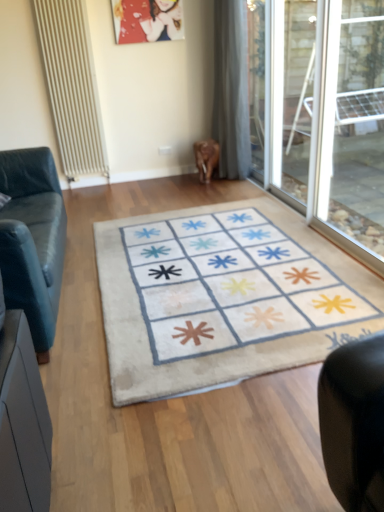
Question: Considering the relative sizes of matte plastic picture frame at upper center and beige textured radiator at left in the image provided, is matte plastic picture frame at upper center wider than beige textured radiator at left?

Choices:
 (A) yes
 (B) no

Answer: (B)

Question: From the image's perspective, does matte plastic picture frame at upper center appear lower than beige textured radiator at left?

Choices:
 (A) yes
 (B) no

Answer: (B)

Question: Does matte plastic picture frame at upper center have a larger size compared to beige textured radiator at left?

Choices:
 (A) no
 (B) yes

Answer: (A)

Question: Could you tell me if matte plastic picture frame at upper center is facing beige textured radiator at left?

Choices:
 (A) yes
 (B) no

Answer: (B)

Question: Is matte plastic picture frame at upper center behind beige textured radiator at left?

Choices:
 (A) yes
 (B) no

Answer: (A)

Question: From a real-world perspective, is gray fabric curtain at center physically located above or below leather couch at left?

Choices:
 (A) below
 (B) above

Answer: (B)

Question: Relative to leather couch at left, is gray fabric curtain at center in front or behind?

Choices:
 (A) front
 (B) behind

Answer: (B)

Question: Do you think gray fabric curtain at center is within leather couch at left, or outside of it?

Choices:
 (A) inside
 (B) outside

Answer: (B)

Question: Is gray fabric curtain at center taller or shorter than leather couch at left?

Choices:
 (A) short
 (B) tall

Answer: (B)

Question: Considering the positions of beige textured radiator at left and transparent glass window at right in the image, is beige textured radiator at left wider or thinner than transparent glass window at right?

Choices:
 (A) wide
 (B) thin

Answer: (B)

Question: Considering their positions, is beige textured radiator at left located in front of or behind transparent glass window at right?

Choices:
 (A) front
 (B) behind

Answer: (B)

Question: From a real-world perspective, is beige textured radiator at left positioned above or below transparent glass window at right?

Choices:
 (A) below
 (B) above

Answer: (B)

Question: Is beige textured radiator at left taller or shorter than transparent glass window at right?

Choices:
 (A) short
 (B) tall

Answer: (B)

Question: Considering the relative positions of beige fabric doormat at center and matte plastic picture frame at upper center in the image provided, is beige fabric doormat at center to the left or to the right of matte plastic picture frame at upper center?

Choices:
 (A) right
 (B) left

Answer: (A)

Question: Is beige fabric doormat at center taller or shorter than matte plastic picture frame at upper center?

Choices:
 (A) short
 (B) tall

Answer: (A)